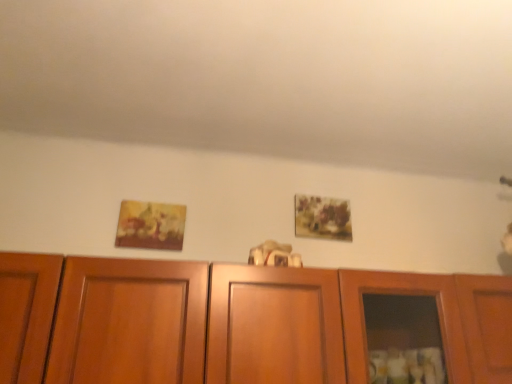
Question: From the image's perspective, relative to matte yellow painting at left, positioned as the second picture frame in right-to-left order, is matte floral painting at upper center, the first picture frame viewed from the back, above or below?

Choices:
 (A) below
 (B) above

Answer: (B)

Question: Based on their sizes in the image, would you say matte floral painting at upper center, the 2th picture frame positioned from the front, is bigger or smaller than matte yellow painting at left, placed as the 1th picture frame when sorted from front to back?

Choices:
 (A) small
 (B) big

Answer: (A)

Question: Which of these objects is positioned closest to the wooden cabinet at center?

Choices:
 (A) matte floral painting at upper center, placed as the 2th picture frame when sorted from left to right
 (B) matte yellow painting at left, positioned as the second picture frame in back-to-front order

Answer: (A)

Question: Estimate the real-world distances between objects in this image. Which object is farther from the matte yellow painting at left, placed as the 1th picture frame when sorted from front to back?

Choices:
 (A) matte floral painting at upper center, placed as the 2th picture frame when sorted from left to right
 (B) wooden cabinet at center

Answer: (B)